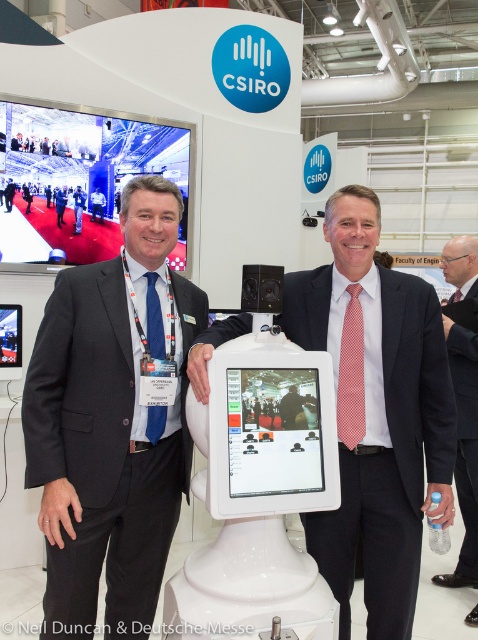
You are a photographer at the event and need to position a spotlight at the point marked by coordinates point (104, 452). What object should the spotlight be directed towards?

The point (104, 452) corresponds to the matte black suit at center, so the spotlight should be directed towards the matte black suit at center.

You are a technician who needs to adjust the focus of a camera. The focal length of your camera is 2 meters. Is the point at coordinates point (142,230) within the focal range of the camera?

The distance of point (142,230) from camera is 1.71 meters. Since the focal length is 2 meters, the point is within the focal range.

You are a fashion designer attending a tech exhibition and see two suits displayed. The first is a matte black suit at center and the second is a pink fabric suit at right. Which one is located to the left of the other?

The matte black suit at center is positioned on the left side of the pink fabric suit at right.